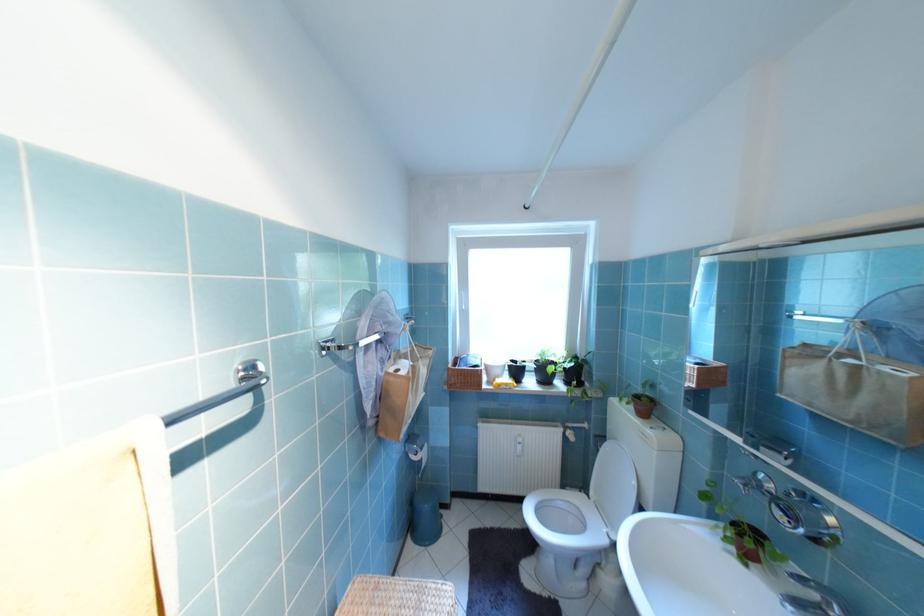
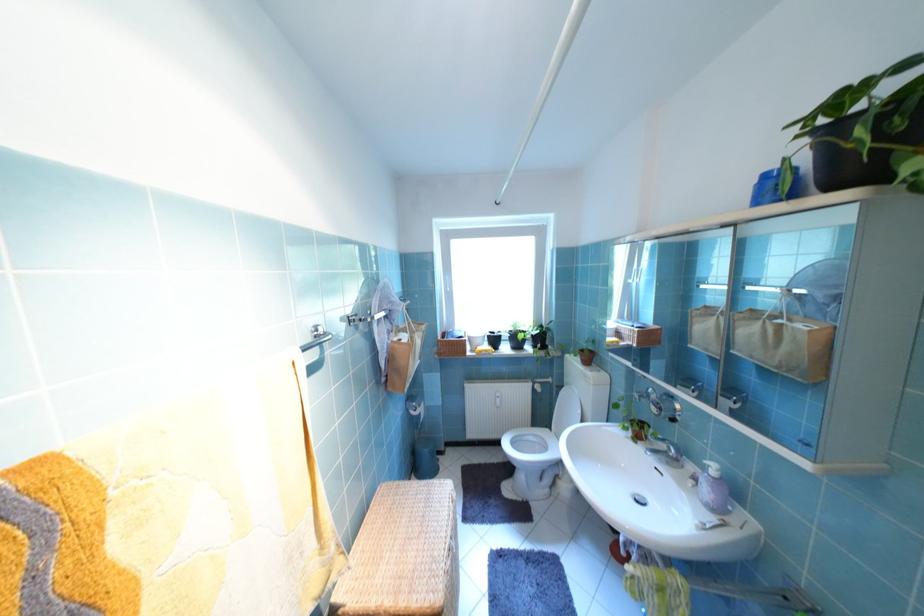
Where in the second image is the point corresponding to point (411, 352) from the first image?

(410, 326)